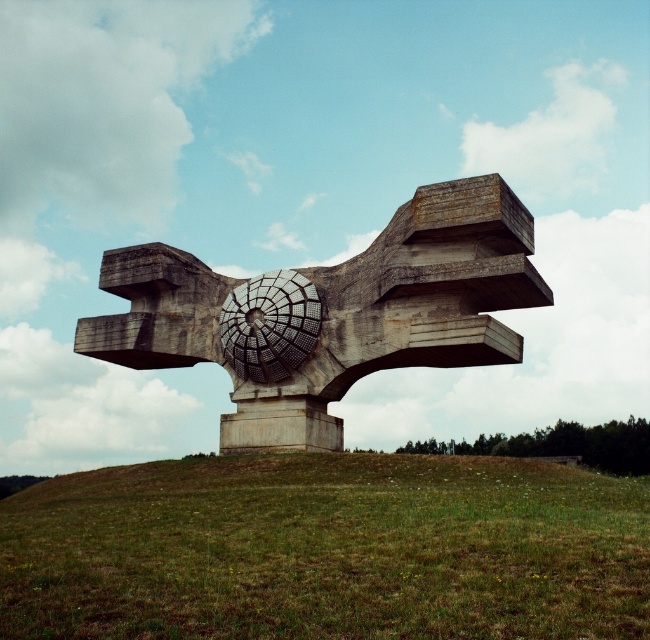
Does green grass at center appear under gray concrete sculpture at center?

Yes, green grass at center is below gray concrete sculpture at center.

Locate an element on the screen. green grass at center is located at coordinates (328, 548).